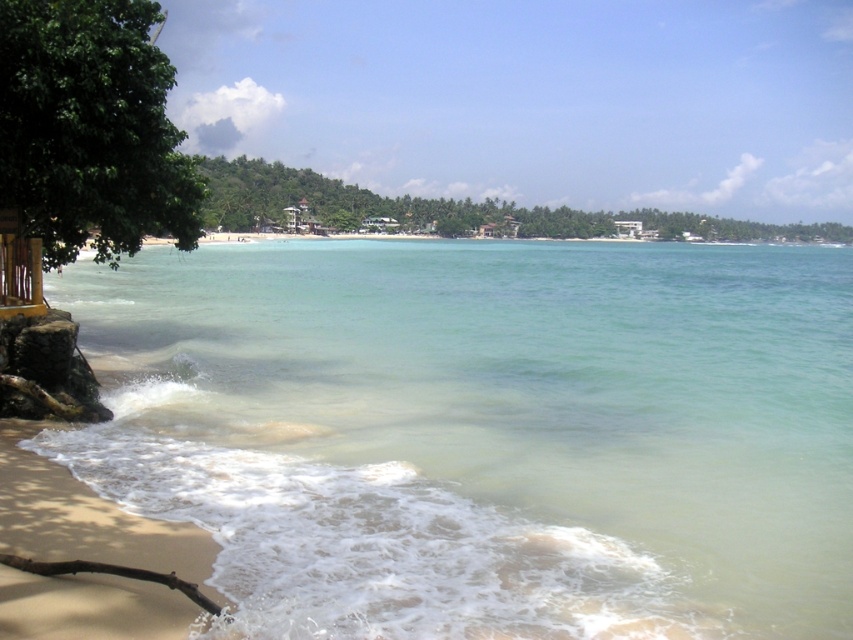
You are standing on the beach and want to take a photo of the green leafy tree at left. If your camera can focus on objects up to 12 meters away, will you need to move closer to the tree to get a clear shot?

The green leafy tree at left is 13.46 meters away from the viewer. Since the camera can only focus up to 12 meters, you need to move closer to the tree to ensure it is within the camera range.

You are a lifeguard standing on the beach and need to reach the green leafy tree at upper center from the clear water at lower left. Considering the distance between them, can you estimate whether you can walk directly to the tree without any obstacles?

The distance between the clear water at lower left and the green leafy tree at upper center is 71.38 meters. Assuming there are no obstacles, you can walk directly to the tree, but the distance may require some effort.

You are standing on the beach and see two points marked on the sand. The first point is at coordinates point [143,563] and the second is at point [415,211]. Which point is closer to you?

Point [143,563] is in front of point [415,211], so it is closer to you.